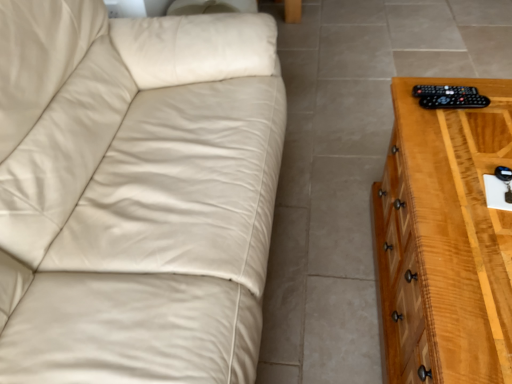
This screenshot has height=384, width=512. In order to click on free space above light brown wooden chest of drawers at right (from a real-world perspective) in this screenshot , I will do `click(473, 163)`.